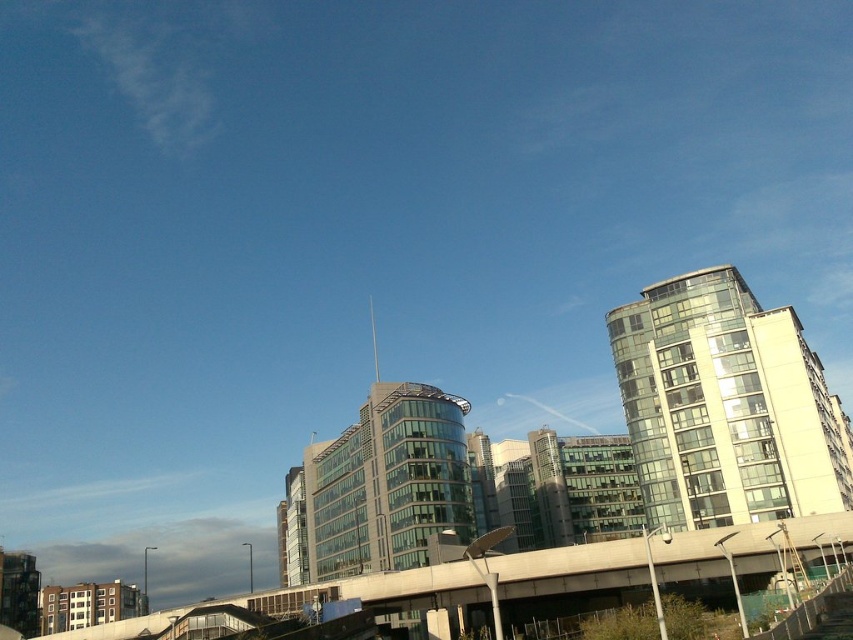
From the picture: You are a drone operator trying to capture a photo of the glassy white building at upper right and the concrete overpass at lower center. From your current position, which object is closer to the camera?

The glassy white building at upper right is closer to the camera than the concrete overpass at lower center because the concrete overpass at lower center is positioned behind it.

You are standing on the pedestrian walkway in the scene and want to move towards the curved glass building in the background. There are two points marked as point 1 at coordinates point [762,380] and point 2 at coordinates point [691,538]. Which point should you head towards to stay on the path leading directly to the building?

You should head towards point [762,380] because it is behind point [691,538], meaning it is closer to the curved glass building in the background that you want to reach.

You are standing at the point with coordinates (724, 404) in the image. What object is located at this point?

The glassy white building at upper right is located at point (724, 404).